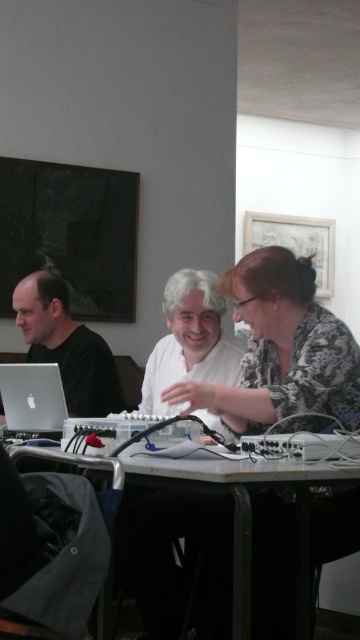
Is white plastic table at center shorter than silver metallic laptop at lower left?

No.

Who is positioned more to the left, white plastic table at center or silver metallic laptop at lower left?

From the viewer's perspective, silver metallic laptop at lower left appears more on the left side.

Between point (0, 564) and point (60, 385), which one is positioned in front?

Point (0, 564)

I want to click on white plastic table at center, so click(x=51, y=548).

Who is more forward, (82, 480) or (45, 308)?

Point (82, 480) is in front.

Locate an element on the screen. The width and height of the screenshot is (360, 640). white plastic table at center is located at coordinates (51, 548).

This screenshot has width=360, height=640. Identify the location of white plastic table at center. (51, 548).

Between patterned fabric shirt at center and matte black laptop at left, which one is positioned higher?

patterned fabric shirt at center

Can you confirm if patterned fabric shirt at center is positioned to the right of matte black laptop at left?

Correct, you'll find patterned fabric shirt at center to the right of matte black laptop at left.

Who is more forward, (282, 401) or (83, 388)?

Positioned in front is point (282, 401).

Locate an element on the screen. patterned fabric shirt at center is located at coordinates (281, 353).